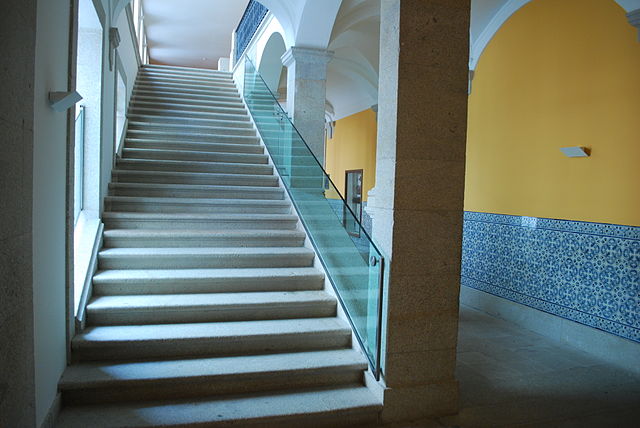
Identify the location of geometric blue and white tiles. (541, 261).